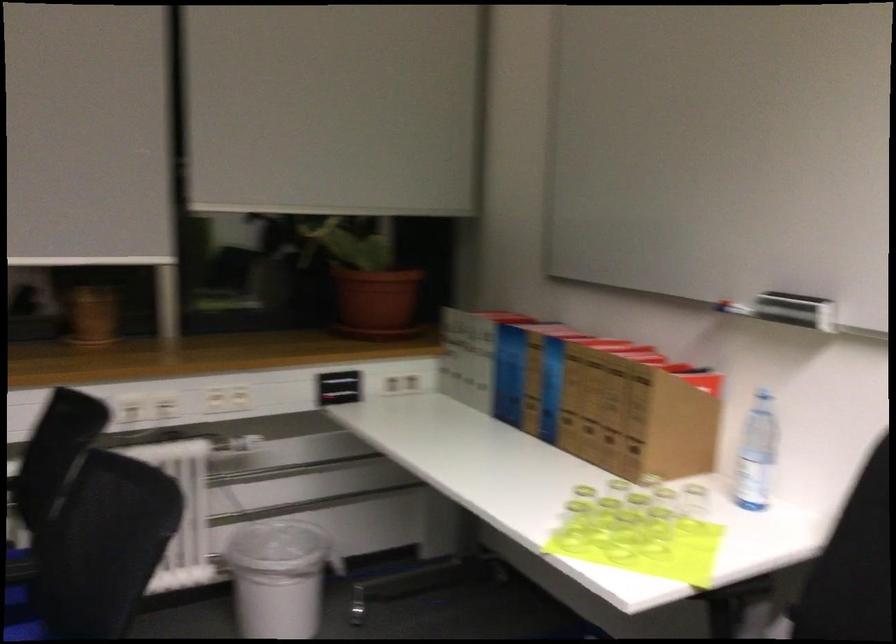
Identify the location of whiteboard eraser. (795, 310).